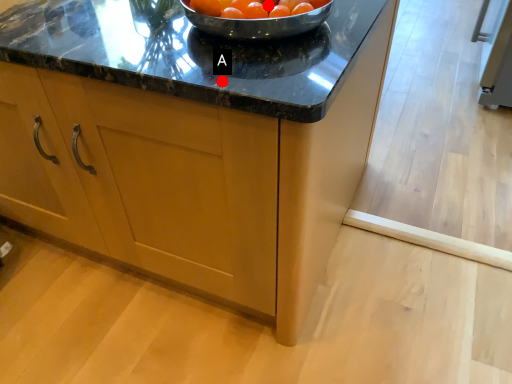
Question: Two points are circled on the image, labeled by A and B beside each circle. Which point is closer to the camera?

Choices:
 (A) A is closer
 (B) B is closer

Answer: (A)